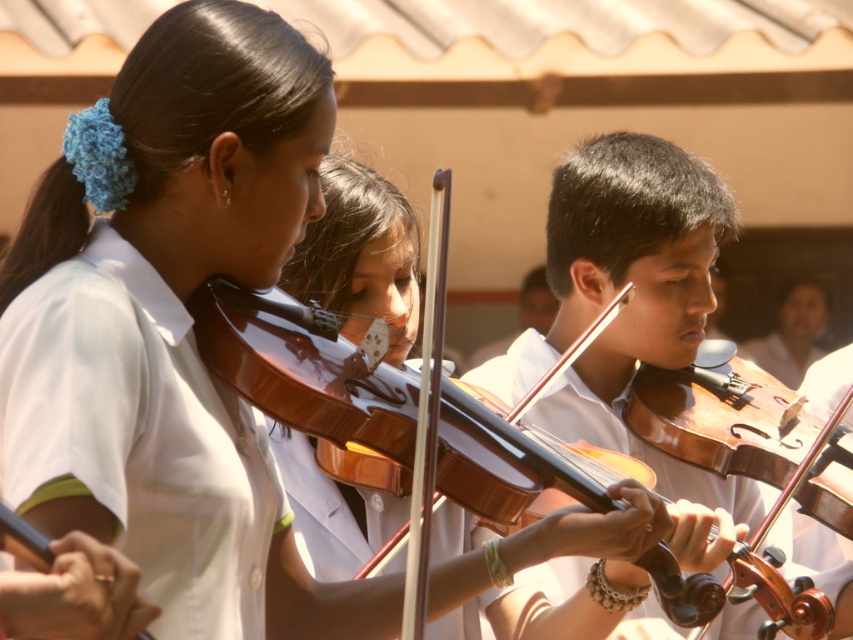
Between wooden violin at center and shiny brown violin at center, which one is positioned lower?

shiny brown violin at center is lower down.

Between wooden violin at center and shiny brown violin at center, which one is positioned higher?

Positioned higher is wooden violin at center.

Is point (578, 365) behind point (718, 602)?

Yes, point (578, 365) is farther from viewer.

Where is `wooden violin at center`? This screenshot has width=853, height=640. wooden violin at center is located at coordinates (628, 304).